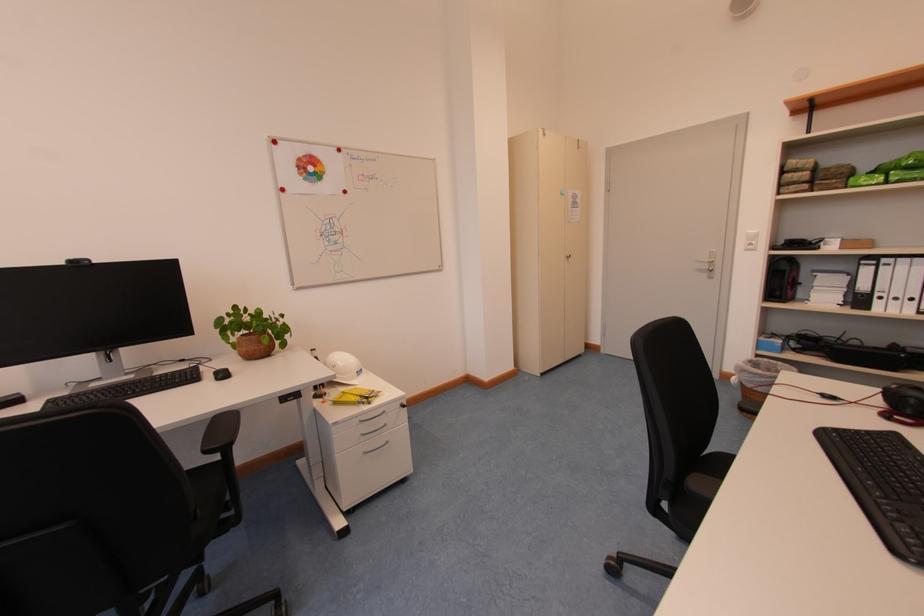
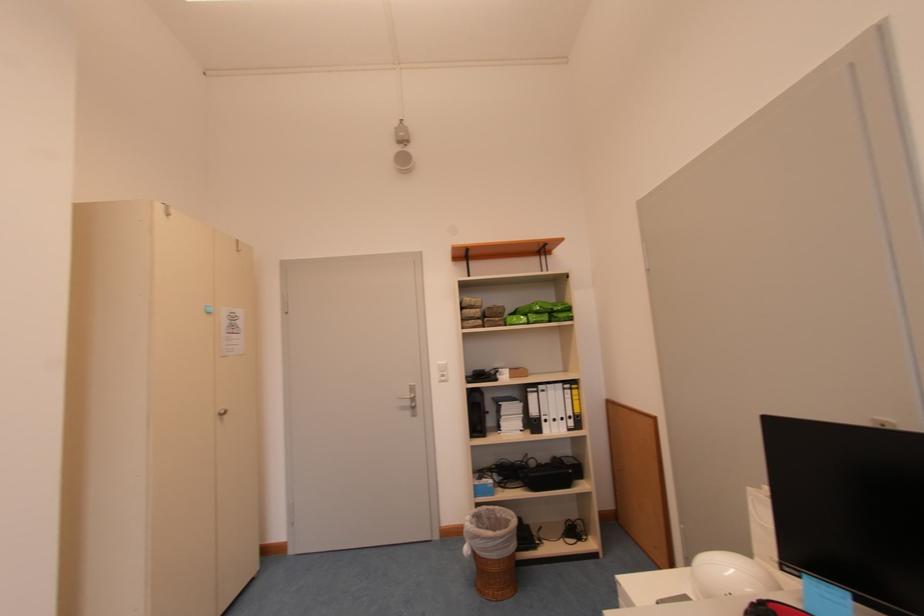
In the second image, find the point that corresponds to the point at 889,301 in the first image.

(553, 424)